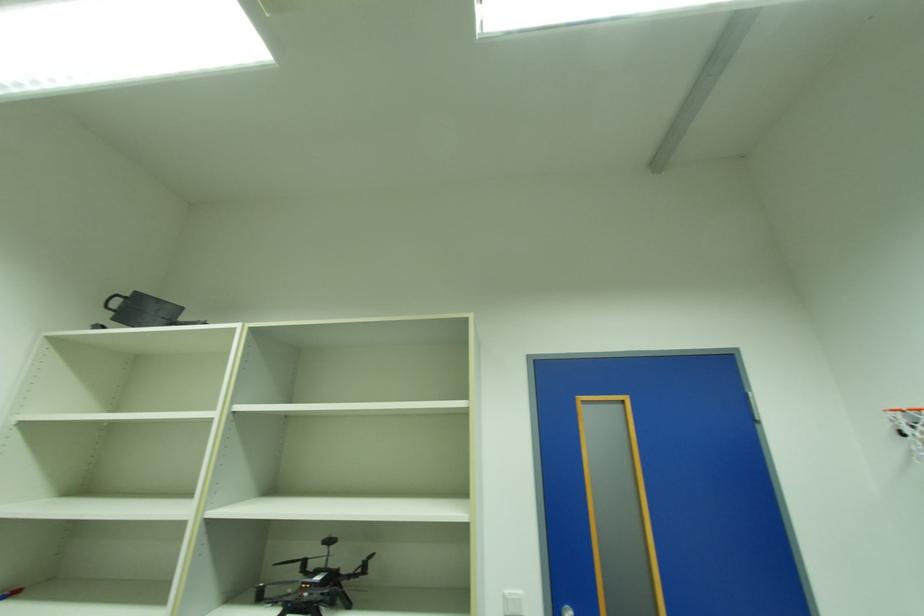
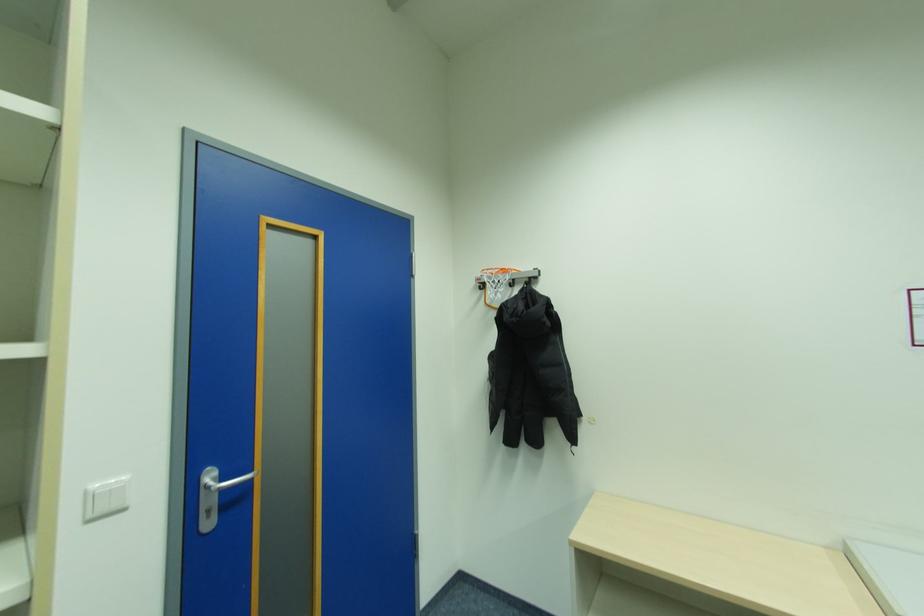
Question: How did the camera likely rotate?

Choices:
 (A) Left
 (B) Right
 (C) Up
 (D) Down

Answer: (B)